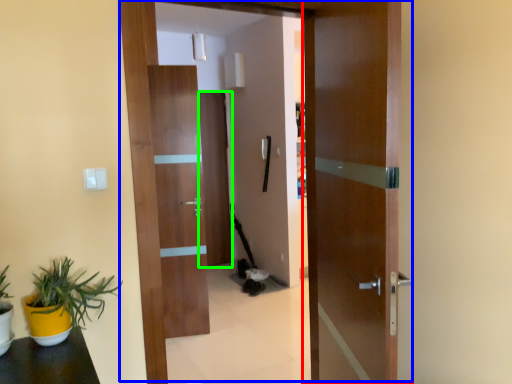
Question: Which object is the closest to the door (highlighted by a red box)? Choose among these: door (highlighted by a blue box) or door (highlighted by a green box).

Choices:
 (A) door
 (B) door

Answer: (A)